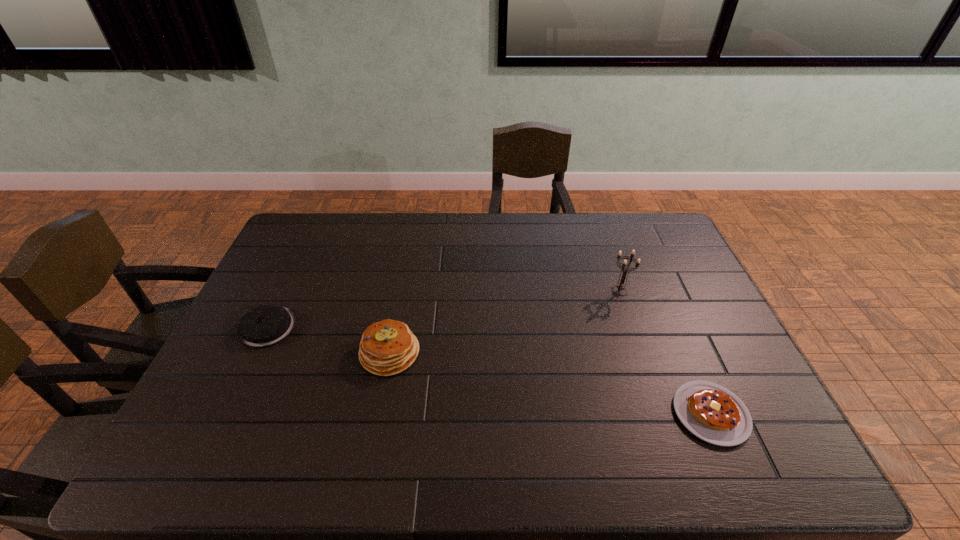
At what (x,y) coordinates should I click in order to perform the action: click on vacant space located on the right of the leftmost pancake. Please return your answer as a coordinate pair (x, y). The image size is (960, 540). Looking at the image, I should click on (364, 327).

This screenshot has width=960, height=540. In order to click on free region located on the left of the shortest pancake in this screenshot , I will do `click(637, 414)`.

In order to click on object that is at the near edge in this screenshot , I will do `click(711, 412)`.

Find the location of a particular element. The image size is (960, 540). object that is at the left edge is located at coordinates (265, 325).

Find the location of a particular element. object present at the right edge is located at coordinates pyautogui.click(x=711, y=412).

Image resolution: width=960 pixels, height=540 pixels. I want to click on object at the near right corner, so click(711, 412).

At what (x,y) coordinates should I click in order to perform the action: click on vacant space at the far edge of the desktop. Please return your answer as a coordinate pair (x, y). Looking at the image, I should click on (594, 222).

In the image, there is a desktop. Where is `free space at the near edge`? The width and height of the screenshot is (960, 540). free space at the near edge is located at coordinates (480, 441).

The height and width of the screenshot is (540, 960). Find the location of `free space at the left edge of the desktop`. free space at the left edge of the desktop is located at coordinates (212, 383).

I want to click on free region at the right edge, so click(677, 273).